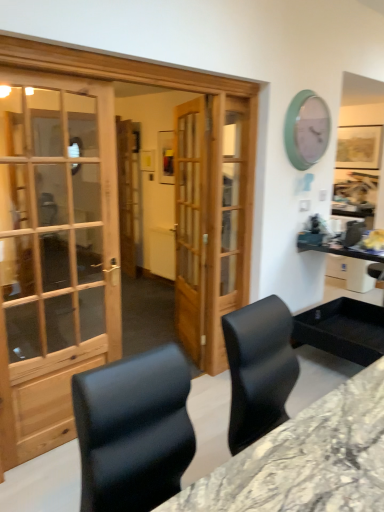
Find the location of a particular element. The width and height of the screenshot is (384, 512). vacant space situated above teal plastic clock at upper right (from a real-world perspective) is located at coordinates (310, 90).